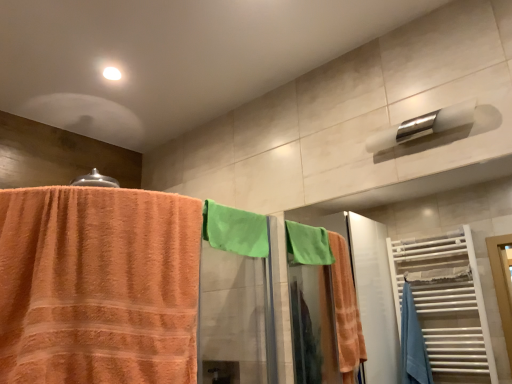
Question: From the image's perspective, is white glossy towel bar at upper right on orange terry cloth towel at left?

Choices:
 (A) yes
 (B) no

Answer: (A)

Question: Can you confirm if white glossy towel bar at upper right is shorter than orange terry cloth towel at left?

Choices:
 (A) no
 (B) yes

Answer: (B)

Question: Does white glossy towel bar at upper right have a greater height compared to orange terry cloth towel at left?

Choices:
 (A) yes
 (B) no

Answer: (B)

Question: Does white glossy towel bar at upper right appear on the left side of orange terry cloth towel at left?

Choices:
 (A) no
 (B) yes

Answer: (A)

Question: Is white glossy towel bar at upper right not inside orange terry cloth towel at left?

Choices:
 (A) no
 (B) yes

Answer: (B)

Question: Choose the correct answer: Is orange terry cloth towel at left inside white glossy towel bar at upper right or outside it?

Choices:
 (A) inside
 (B) outside

Answer: (B)

Question: From a real-world perspective, is orange terry cloth towel at left positioned above or below white glossy towel bar at upper right?

Choices:
 (A) above
 (B) below

Answer: (B)

Question: In terms of width, does orange terry cloth towel at left look wider or thinner when compared to white glossy towel bar at upper right?

Choices:
 (A) wide
 (B) thin

Answer: (A)

Question: From the image's perspective, is orange terry cloth towel at left above or below white glossy towel bar at upper right?

Choices:
 (A) above
 (B) below

Answer: (B)

Question: From their relative heights in the image, would you say green terry cloth towel at center is taller or shorter than white glossy towel bar at upper right?

Choices:
 (A) tall
 (B) short

Answer: (A)

Question: In the image, is green terry cloth towel at center on the left side or the right side of white glossy towel bar at upper right?

Choices:
 (A) right
 (B) left

Answer: (B)

Question: Is green terry cloth towel at center bigger or smaller than white glossy towel bar at upper right?

Choices:
 (A) small
 (B) big

Answer: (A)

Question: From the image's perspective, relative to white glossy towel bar at upper right, is green terry cloth towel at center above or below?

Choices:
 (A) below
 (B) above

Answer: (A)

Question: From the image's perspective, is white glossy towel bar at upper right above or below green terry cloth towel at center?

Choices:
 (A) below
 (B) above

Answer: (B)

Question: In the image, is white glossy towel bar at upper right positioned in front of or behind green terry cloth towel at center?

Choices:
 (A) behind
 (B) front

Answer: (B)